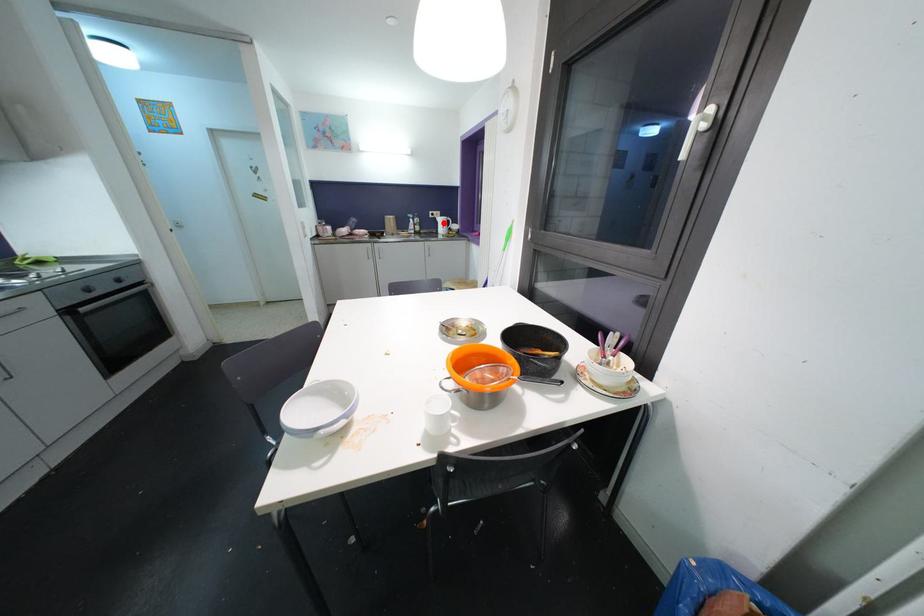
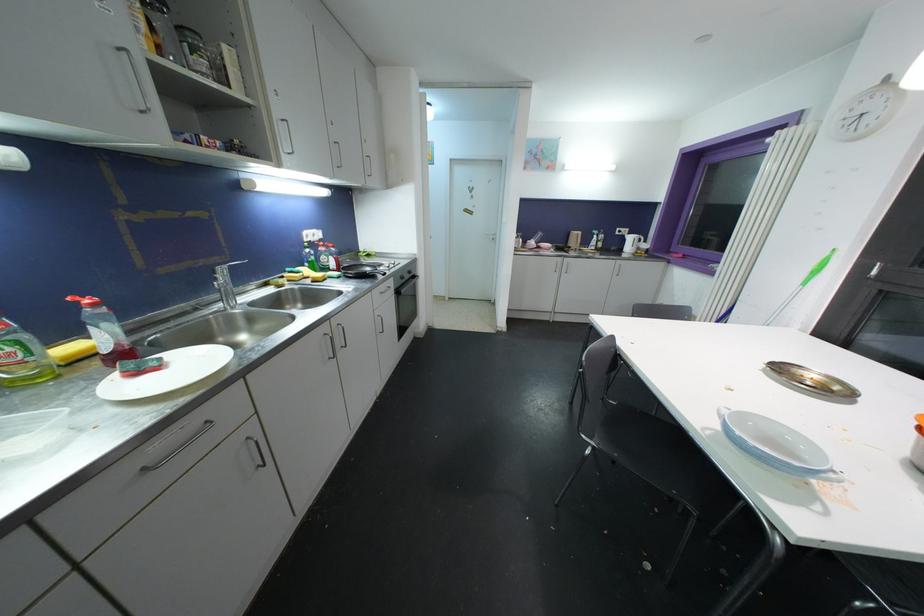
The point at the highlighted location is marked in the first image. Where is the corresponding point in the second image?

(634, 241)